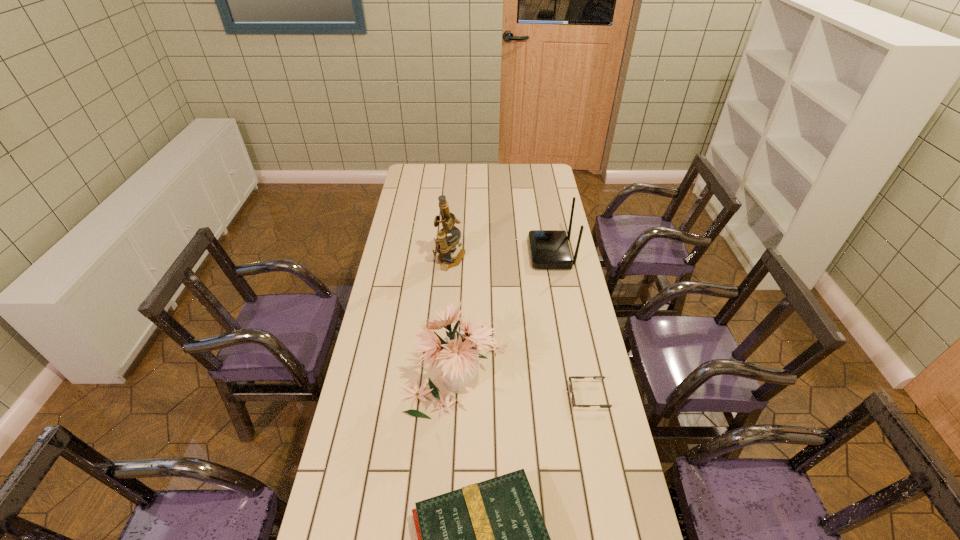
Locate an element on the screen. The width and height of the screenshot is (960, 540). vacant area in the image that satisfies the following two spatial constraints: 1. on the front-facing side of the router; 2. on the front side of the microscope is located at coordinates (552, 261).